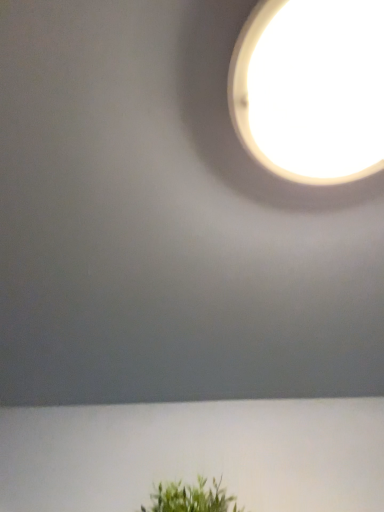
Question: Can you confirm if white glossy lampshade at upper center is positioned to the left of green leafy plant at lower center?

Choices:
 (A) yes
 (B) no

Answer: (B)

Question: Considering the relative sizes of white glossy lampshade at upper center and green leafy plant at lower center in the image provided, is white glossy lampshade at upper center wider than green leafy plant at lower center?

Choices:
 (A) yes
 (B) no

Answer: (A)

Question: Does white glossy lampshade at upper center have a smaller size compared to green leafy plant at lower center?

Choices:
 (A) yes
 (B) no

Answer: (A)

Question: From a real-world perspective, is white glossy lampshade at upper center located beneath green leafy plant at lower center?

Choices:
 (A) yes
 (B) no

Answer: (B)

Question: From the image's perspective, is white glossy lampshade at upper center below green leafy plant at lower center?

Choices:
 (A) yes
 (B) no

Answer: (B)

Question: Is white glossy lampshade at upper center directly adjacent to green leafy plant at lower center?

Choices:
 (A) no
 (B) yes

Answer: (A)

Question: From the image's perspective, is green leafy plant at lower center below white glossy lampshade at upper center?

Choices:
 (A) yes
 (B) no

Answer: (A)

Question: From a real-world perspective, is green leafy plant at lower center positioned under white glossy lampshade at upper center based on gravity?

Choices:
 (A) yes
 (B) no

Answer: (A)

Question: Is green leafy plant at lower center at the left side of white glossy lampshade at upper center?

Choices:
 (A) no
 (B) yes

Answer: (B)

Question: From a real-world perspective, is green leafy plant at lower center over white glossy lampshade at upper center?

Choices:
 (A) yes
 (B) no

Answer: (B)

Question: Is green leafy plant at lower center at the right side of white glossy lampshade at upper center?

Choices:
 (A) no
 (B) yes

Answer: (A)

Question: Is green leafy plant at lower center turned away from white glossy lampshade at upper center?

Choices:
 (A) no
 (B) yes

Answer: (A)

Question: Considering the positions of point (215, 493) and point (279, 147), is point (215, 493) closer or farther from the camera than point (279, 147)?

Choices:
 (A) closer
 (B) farther

Answer: (B)